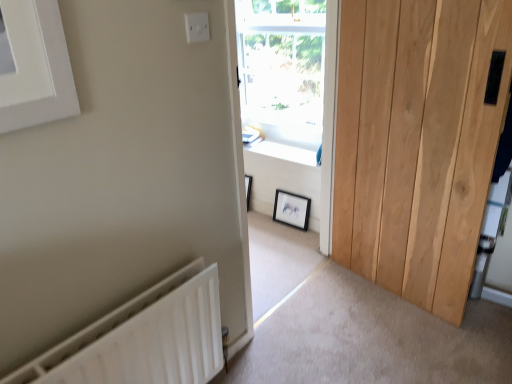
Where is `free space above natural wood door at right (from a real-world perspective)`? The image size is (512, 384). free space above natural wood door at right (from a real-world perspective) is located at coordinates (397, 0).